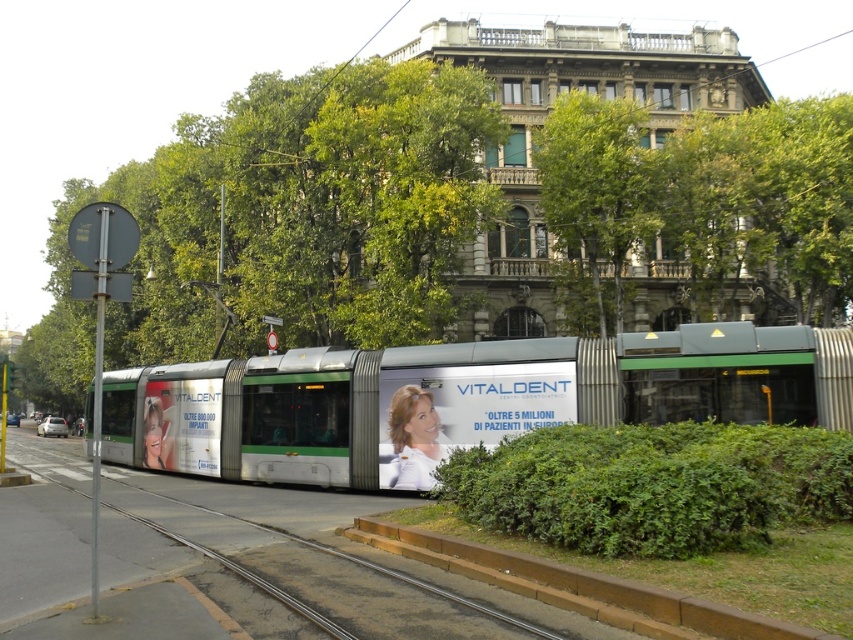
You are a pedestrian standing on the sidewalk and want to cross the street to reach the park on the other side. The green metallic tram at center is blocking your path. Can you walk around it using the metal train track at center as a guide?

The green metallic tram at center is to the right of metal train track at center, so you can walk around the tram by moving along the metal train track at center to the left side of the tram to reach the park.

You are standing on the sidewalk and see two points marked on the tram. The first point is at coordinate point [575,371] and the second is at point [27,627]. Which point is closer to you?

Point [575,371] is further to the viewer than point [27,627], so the point closer to you is point [27,627].